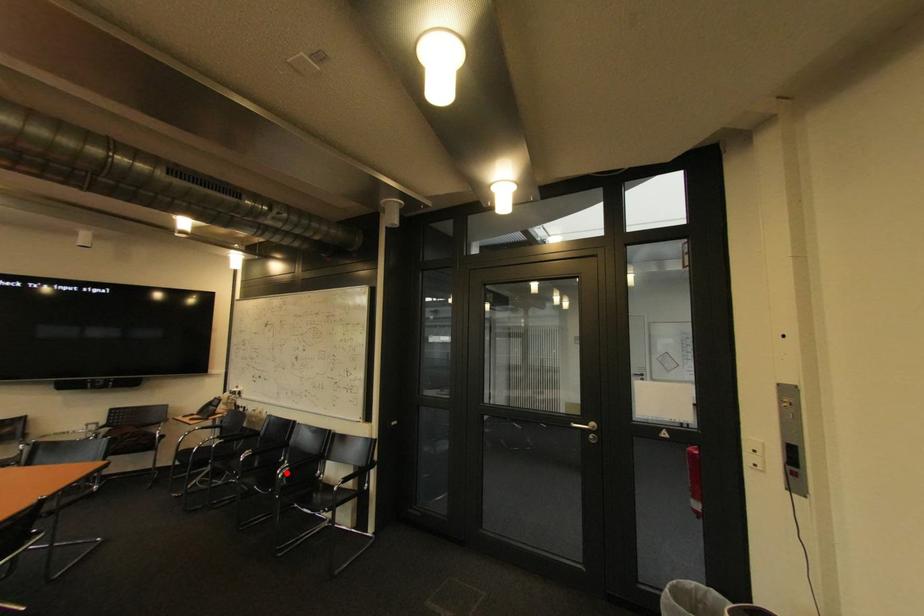
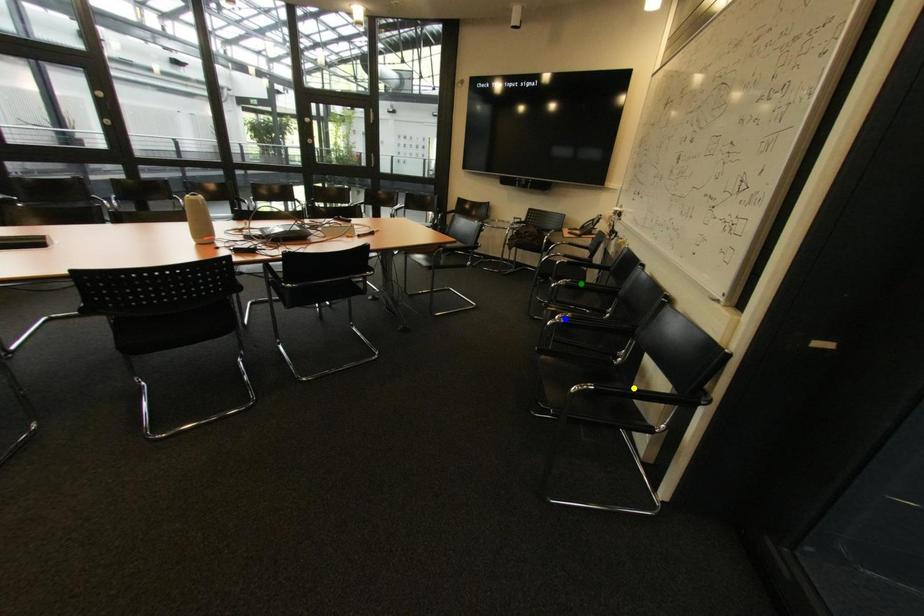
Question: I am providing you with two images of the same scene from different viewpoints. A red point is marked on the first image. You are given multiple points on the second image. Can you choose the point in image 2 that corresponds to the point in image 1?

Choices:
 (A) yellow point
 (B) green point
 (C) blue point

Answer: (C)